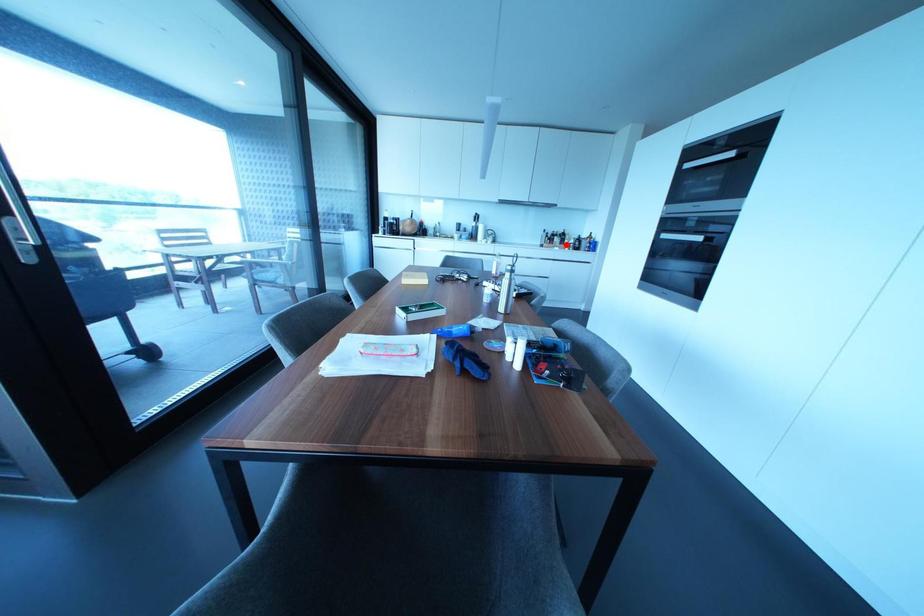
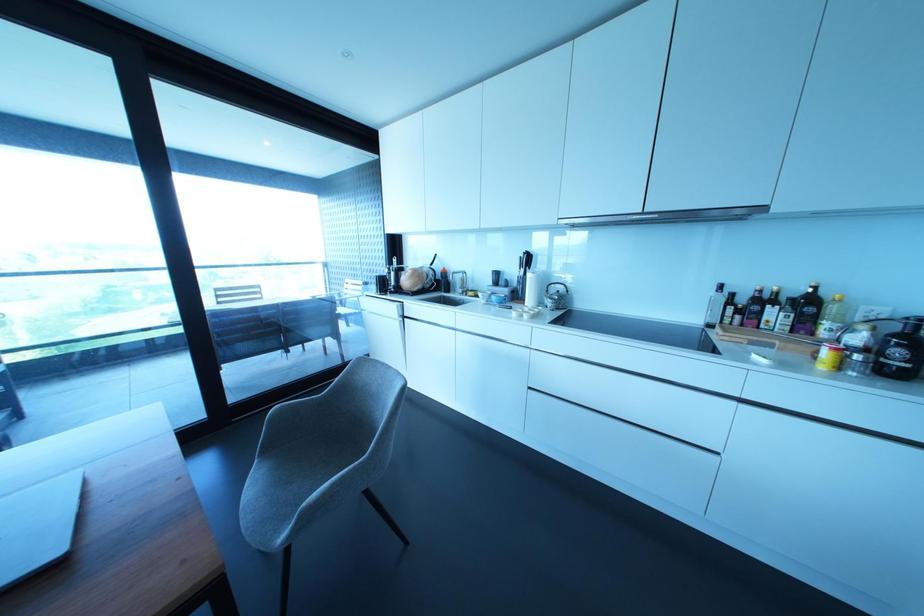
Question: I am providing you with two images of the same scene from different viewpoints. Given a red point in image1, look at the same physical point in image2. Is it:

Choices:
 (A) Closer to the viewpoint
 (B) Farther from the viewpoint

Answer: (B)